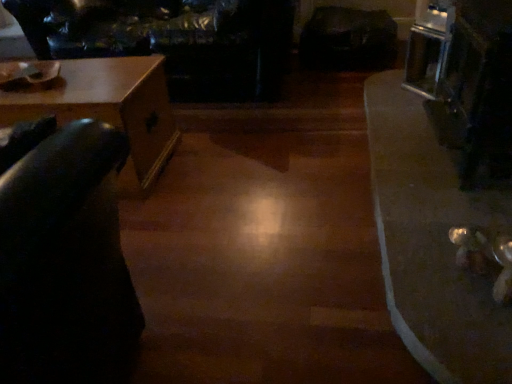
Question: Considering their positions, is leather couch at upper left located in front of or behind wooden table at left, the first table from the left?

Choices:
 (A) front
 (B) behind

Answer: (B)

Question: Is leather couch at upper left taller or shorter than wooden table at left, the first table from the left?

Choices:
 (A) short
 (B) tall

Answer: (B)

Question: Estimate the real-world distances between objects in this image. Which object is closer to the leather couch at upper left?

Choices:
 (A) shiny metallic table at lower right, placed as the second table when sorted from left to right
 (B) wooden table at left, which is the second table from right to left

Answer: (B)

Question: Which is farther from the shiny metallic table at lower right, placed as the second table when sorted from left to right?

Choices:
 (A) wooden table at left, which is the second table from right to left
 (B) leather couch at upper left

Answer: (B)